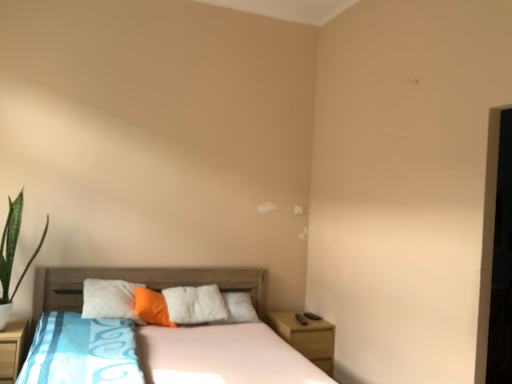
Question: From the image's perspective, is wooden bed at center on top of green leafy plant at left?

Choices:
 (A) yes
 (B) no

Answer: (B)

Question: Is wooden bed at center surrounding green leafy plant at left?

Choices:
 (A) no
 (B) yes

Answer: (A)

Question: Is wooden bed at center further to the viewer compared to green leafy plant at left?

Choices:
 (A) no
 (B) yes

Answer: (A)

Question: Is wooden bed at center wider than green leafy plant at left?

Choices:
 (A) no
 (B) yes

Answer: (B)

Question: From the image's perspective, is wooden bed at center below green leafy plant at left?

Choices:
 (A) no
 (B) yes

Answer: (B)

Question: Would you say wooden nightstand at lower left, the 2th nightstand in the back-to-front sequence, is to the left or to the right of green leafy plant at left in the picture?

Choices:
 (A) left
 (B) right

Answer: (A)

Question: Is point (22, 360) closer or farther from the camera than point (3, 238)?

Choices:
 (A) farther
 (B) closer

Answer: (B)

Question: From their relative heights in the image, would you say wooden nightstand at lower left, the first nightstand positioned from the left, is taller or shorter than green leafy plant at left?

Choices:
 (A) short
 (B) tall

Answer: (A)

Question: Is wooden nightstand at lower left, the 1th nightstand viewed from the front, in front of or behind green leafy plant at left in the image?

Choices:
 (A) behind
 (B) front

Answer: (A)

Question: Considering the positions of point (9, 364) and point (147, 311), is point (9, 364) closer or farther from the camera than point (147, 311)?

Choices:
 (A) farther
 (B) closer

Answer: (B)

Question: Relative to orange soft pillow at center, is wooden nightstand at lower left, the first nightstand positioned from the left, in front or behind?

Choices:
 (A) front
 (B) behind

Answer: (A)

Question: Is wooden nightstand at lower left, the first nightstand positioned from the left, bigger or smaller than orange soft pillow at center?

Choices:
 (A) big
 (B) small

Answer: (A)

Question: From a real-world perspective, is wooden nightstand at lower left, the 2th nightstand in the back-to-front sequence, above or below orange soft pillow at center?

Choices:
 (A) below
 (B) above

Answer: (A)

Question: From a real-world perspective, is wooden bed at center physically located above or below green leafy plant at left?

Choices:
 (A) above
 (B) below

Answer: (B)

Question: Looking at the image, does wooden bed at center seem bigger or smaller compared to green leafy plant at left?

Choices:
 (A) big
 (B) small

Answer: (A)